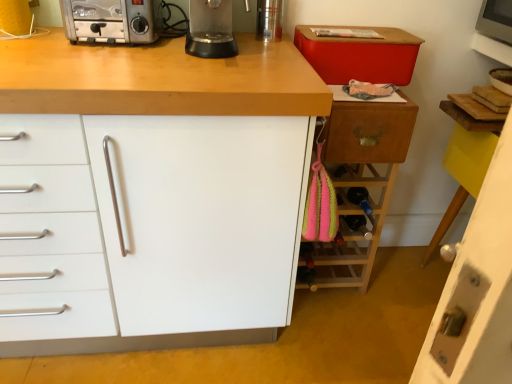
What are the coordinates of `free point below wooden drawer at right (from a real-world perspective)` in the screenshot? It's located at (335, 296).